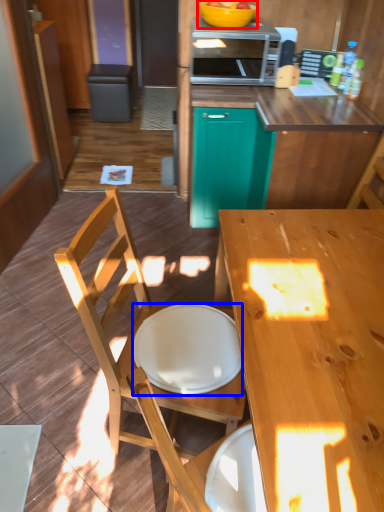
Question: Among these objects, which one is farthest to the camera, bowl (highlighted by a red box) or plate (highlighted by a blue box)?

Choices:
 (A) bowl
 (B) plate

Answer: (A)